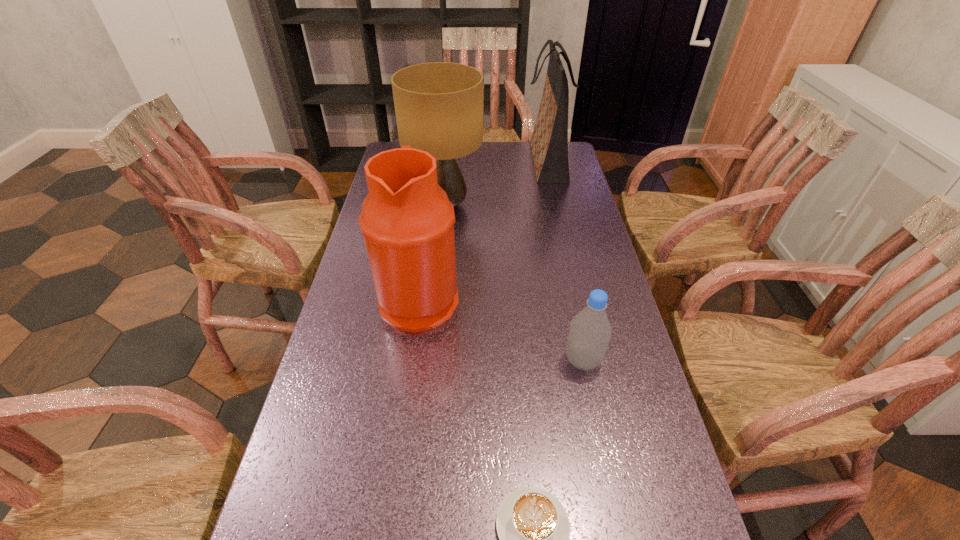
Image resolution: width=960 pixels, height=540 pixels. In order to click on shopping bag in this screenshot , I will do `click(549, 143)`.

Identify the location of the fourth nearest object. (439, 105).

You are a GUI agent. You are given a task and a screenshot of the screen. Output one action in this format:
    pyautogui.click(x=<x>, y=<y>)
    Task: Click on the water jug
    The image size is (960, 540).
    Given the screenshot: What is the action you would take?
    pyautogui.click(x=407, y=220)

Find the location of a particular element. The width and height of the screenshot is (960, 540). the second nearest object is located at coordinates (590, 331).

This screenshot has height=540, width=960. I want to click on bottle, so click(590, 331).

Where is `free spot located 0.320m on the front-facing side of the shopping bag`? free spot located 0.320m on the front-facing side of the shopping bag is located at coordinates (442, 162).

Image resolution: width=960 pixels, height=540 pixels. In order to click on free space located on the front-facing side of the shopping bag in this screenshot , I will do `click(455, 162)`.

Find the location of a particular element. The height and width of the screenshot is (540, 960). vacant region located 0.300m on the front-facing side of the shopping bag is located at coordinates (446, 162).

The width and height of the screenshot is (960, 540). What are the coordinates of `free spot located 0.390m on the front of the lampshade` in the screenshot? It's located at (434, 321).

Locate an element on the screen. free space located 0.330m from the spout of the third farthest object is located at coordinates (584, 298).